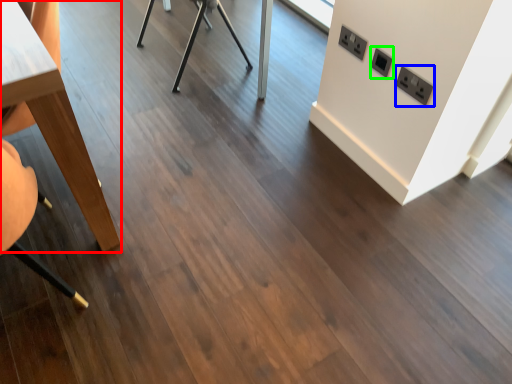
Question: Which is farther away from table (highlighted by a red box)? electric outlet (highlighted by a blue box) or electric outlet (highlighted by a green box)?

Choices:
 (A) electric outlet
 (B) electric outlet

Answer: (A)